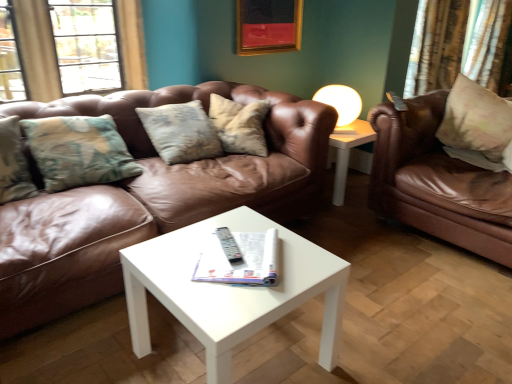
Question: Is white glossy coffee table at center in contact with gold textured curtain at upper right?

Choices:
 (A) yes
 (B) no

Answer: (B)

Question: Considering the relative sizes of white glossy coffee table at center and gold textured curtain at upper right in the image provided, is white glossy coffee table at center smaller than gold textured curtain at upper right?

Choices:
 (A) yes
 (B) no

Answer: (A)

Question: Does white glossy coffee table at center have a greater height compared to gold textured curtain at upper right?

Choices:
 (A) no
 (B) yes

Answer: (A)

Question: Is white glossy coffee table at center shorter than gold textured curtain at upper right?

Choices:
 (A) yes
 (B) no

Answer: (A)

Question: From the image's perspective, is white glossy coffee table at center located above gold textured curtain at upper right?

Choices:
 (A) no
 (B) yes

Answer: (A)

Question: From a real-world perspective, is white glossy coffee table at center located beneath gold textured curtain at upper right?

Choices:
 (A) no
 (B) yes

Answer: (B)

Question: Is white glossy coffee table at center a part of gold textured curtain at upper right?

Choices:
 (A) yes
 (B) no

Answer: (B)

Question: Can you confirm if gold textured curtain at upper right is thinner than white glossy coffee table at center?

Choices:
 (A) yes
 (B) no

Answer: (A)

Question: Is gold textured curtain at upper right positioned behind white glossy coffee table at center?

Choices:
 (A) yes
 (B) no

Answer: (A)

Question: Can we say gold textured curtain at upper right lies outside white glossy coffee table at center?

Choices:
 (A) yes
 (B) no

Answer: (A)

Question: From the image's perspective, is gold textured curtain at upper right located above white glossy coffee table at center?

Choices:
 (A) yes
 (B) no

Answer: (A)

Question: Can you confirm if gold textured curtain at upper right is positioned to the right of white glossy coffee table at center?

Choices:
 (A) yes
 (B) no

Answer: (A)

Question: From a real-world perspective, is brown leather couch at center, which is counted as the 2th studio couch, starting from the right, located higher than floral fabric pillow at right?

Choices:
 (A) no
 (B) yes

Answer: (A)